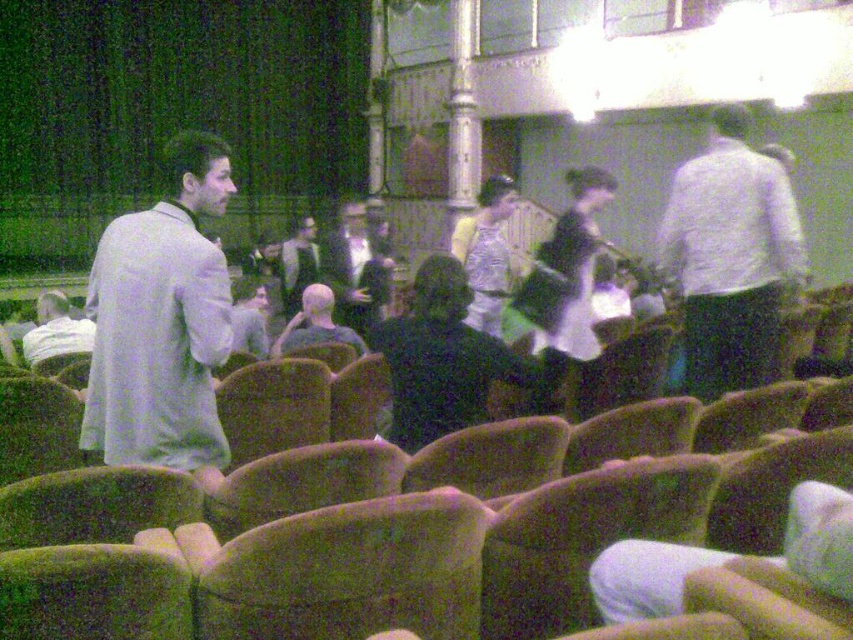
Question: Can you confirm if white matte shirt at right is positioned to the right of black matte jacket at center?

Choices:
 (A) yes
 (B) no

Answer: (A)

Question: Which of the following is the closest to the observer?

Choices:
 (A) (770, 230)
 (B) (302, 259)

Answer: (A)

Question: Among these objects, which one is nearest to the camera?

Choices:
 (A) dark gray shirt at center
 (B) black matte jacket at center
 (C) dark gray suit at center

Answer: (B)

Question: Is white matte shirt at right below matte black jacket at center?

Choices:
 (A) no
 (B) yes

Answer: (B)

Question: Based on their relative distances, which object is nearer to the black matte jacket at center?

Choices:
 (A) dark gray shirt at center
 (B) dark gray suit at center

Answer: (A)

Question: Is white matte shirt at right above dark gray suit at center?

Choices:
 (A) no
 (B) yes

Answer: (A)